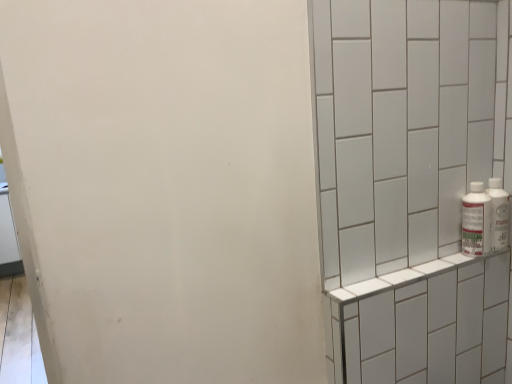
Question: Is white plastic bottle at right, the first bottle from the left, inside the boundaries of white tile shelf at right, or outside?

Choices:
 (A) inside
 (B) outside

Answer: (B)

Question: From the image's perspective, is white plastic bottle at right, the 2th bottle from the right, positioned above or below white tile shelf at right?

Choices:
 (A) below
 (B) above

Answer: (B)

Question: Which is nearer to the white plastic bottle at right, the first bottle from the left?

Choices:
 (A) white plastic bottles at right, the 1th bottle in the right-to-left sequence
 (B) white tile shelf at right

Answer: (A)

Question: Estimate the real-world distances between objects in this image. Which object is farther from the white plastic bottles at right, the 1th bottle in the right-to-left sequence?

Choices:
 (A) white plastic bottle at right, the first bottle from the left
 (B) white tile shelf at right

Answer: (B)